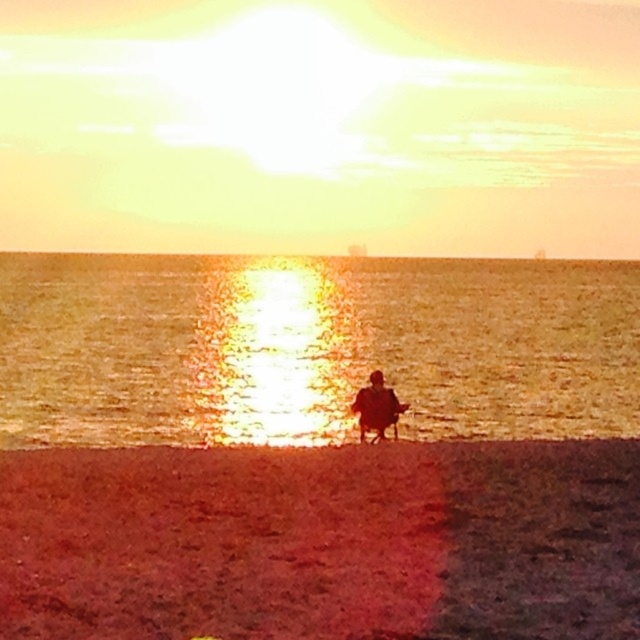
Can you confirm if brown sandy beach at lower center is positioned above shiny golden water at center?

No, brown sandy beach at lower center is not above shiny golden water at center.

Is brown sandy beach at lower center positioned before shiny golden water at center?

Yes.

Is point (582, 529) behind point (52, 260)?

No, (582, 529) is closer to viewer.

I want to click on brown sandy beach at lower center, so click(323, 541).

Between shiny golden water at center and silhouette figure at center, which one is positioned higher?

Positioned higher is shiny golden water at center.

Is point (488, 365) farther from camera compared to point (392, 416)?

That is True.

Find the location of a particular element. Image resolution: width=640 pixels, height=640 pixels. shiny golden water at center is located at coordinates (312, 346).

Is brown sandy beach at lower center smaller than silhouette figure at center?

Yes.

Which of these two, brown sandy beach at lower center or silhouette figure at center, stands taller?

silhouette figure at center

Is point (509, 472) farther from camera compared to point (394, 397)?

That is False.

Locate an element on the screen. Image resolution: width=640 pixels, height=640 pixels. brown sandy beach at lower center is located at coordinates (323, 541).